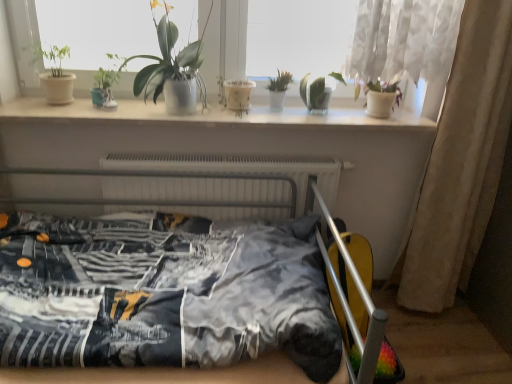
Locate an element on the screen. vacant region below green glossy plant at upper center, the 3th houseplant from the left (from a real-world perspective) is located at coordinates (174, 107).